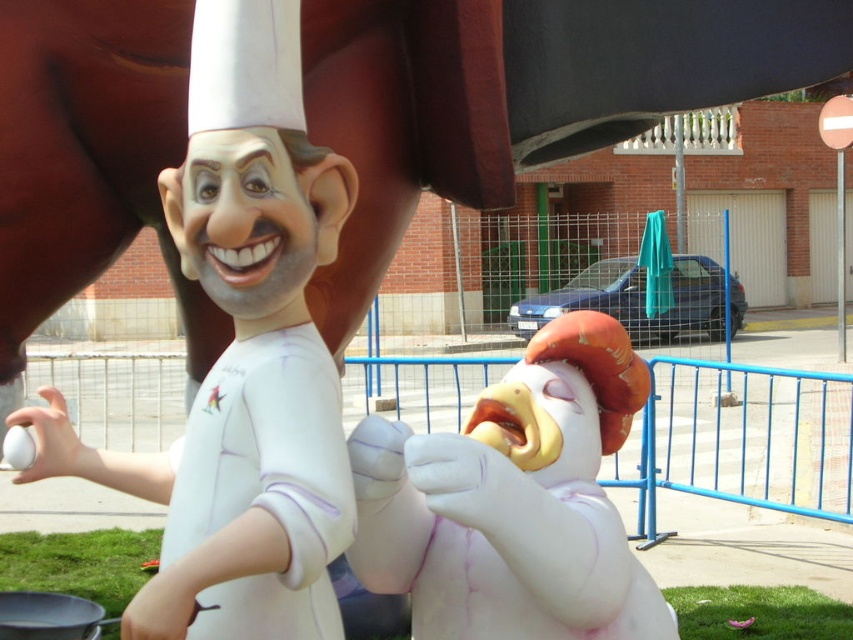
Question: Which point is closer to the camera taking this photo?

Choices:
 (A) (250, 540)
 (B) (401, 436)

Answer: (A)

Question: Is smooth white chicken at center above white matte chef at center?

Choices:
 (A) no
 (B) yes

Answer: (A)

Question: Among these objects, which one is farthest from the camera?

Choices:
 (A) smooth white chicken at center
 (B) white matte chef at center

Answer: (A)

Question: Can you confirm if smooth white chicken at center is smaller than white matte chef at center?

Choices:
 (A) no
 (B) yes

Answer: (B)

Question: Can you confirm if smooth white chicken at center is smaller than white matte chef at center?

Choices:
 (A) no
 (B) yes

Answer: (B)